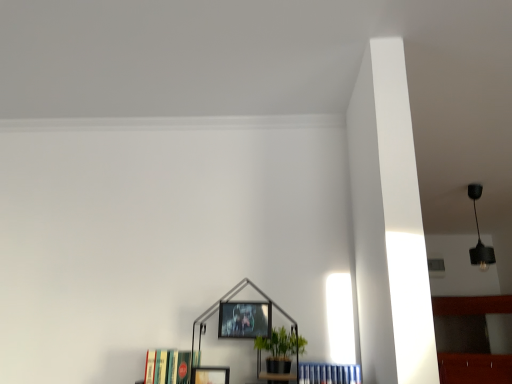
What do you see at coordinates (329, 373) in the screenshot? I see `blue hardcover books at lower center, marked as the second book in a left-to-right arrangement` at bounding box center [329, 373].

Locate an element on the screen. The height and width of the screenshot is (384, 512). green matte plant at center is located at coordinates [x=280, y=349].

Find the location of a particular element. hardcover books at lower left, the first book when ordered from left to right is located at coordinates (169, 366).

Identify the location of metallic silver picture frame at center, acting as the 2th picture frame starting from the bottom. Image resolution: width=512 pixels, height=384 pixels. (245, 320).

From a real-world perspective, is matte black picture frame at lower center, the 1th picture frame ordered from the bottom, physically above hardcover books at lower left, which is the 2th book from right to left?

No, from a real-world perspective, matte black picture frame at lower center, the 1th picture frame ordered from the bottom, is not over hardcover books at lower left, which is the 2th book from right to left

Is hardcover books at lower left, the first book when ordered from left to right, inside matte black picture frame at lower center, which is the first picture frame in left-to-right order?

No, hardcover books at lower left, the first book when ordered from left to right, is located outside of matte black picture frame at lower center, which is the first picture frame in left-to-right order.

Considering the positions of objects matte black picture frame at lower center, placed as the 2th picture frame when sorted from right to left, and hardcover books at lower left, the first book when ordered from left to right, in the image provided, who is more to the left, matte black picture frame at lower center, placed as the 2th picture frame when sorted from right to left, or hardcover books at lower left, the first book when ordered from left to right,?

Positioned to the left is hardcover books at lower left, the first book when ordered from left to right.

Where is `picture frame that is the 1st one when counting backward from the hardcover books at lower left, the first book when ordered from left to right`? The height and width of the screenshot is (384, 512). picture frame that is the 1st one when counting backward from the hardcover books at lower left, the first book when ordered from left to right is located at coordinates (210, 375).

Does blue hardcover books at lower center, which ranks as the first book in right-to-left order, lie in front of matte black picture frame at lower center, the second picture frame viewed from the top?

That is True.

Is blue hardcover books at lower center, marked as the second book in a left-to-right arrangement, not within matte black picture frame at lower center, placed as the 2th picture frame when sorted from right to left?

Indeed, blue hardcover books at lower center, marked as the second book in a left-to-right arrangement, is completely outside matte black picture frame at lower center, placed as the 2th picture frame when sorted from right to left.

Considering the sizes of blue hardcover books at lower center, marked as the second book in a left-to-right arrangement, and matte black picture frame at lower center, which is the first picture frame in left-to-right order, in the image, is blue hardcover books at lower center, marked as the second book in a left-to-right arrangement, taller or shorter than matte black picture frame at lower center, which is the first picture frame in left-to-right order,?

In the image, blue hardcover books at lower center, marked as the second book in a left-to-right arrangement, appears to be taller than matte black picture frame at lower center, which is the first picture frame in left-to-right order.

Looking at this image, is blue hardcover books at lower center, which ranks as the first book in right-to-left order, positioned far away from matte black picture frame at lower center, the 1th picture frame ordered from the bottom?

They are positioned close to each other.

Considering the sizes of objects black matte pendant light at upper right and matte black picture frame at lower center, placed as the 2th picture frame when sorted from right to left, in the image provided, who is wider, black matte pendant light at upper right or matte black picture frame at lower center, placed as the 2th picture frame when sorted from right to left,?

With larger width is black matte pendant light at upper right.

Is black matte pendant light at upper right positioned far away from matte black picture frame at lower center, which is the first picture frame in left-to-right order?

Yes, black matte pendant light at upper right and matte black picture frame at lower center, which is the first picture frame in left-to-right order, are located far from each other.

Who is smaller, black matte pendant light at upper right or matte black picture frame at lower center, the 1th picture frame ordered from the bottom?

matte black picture frame at lower center, the 1th picture frame ordered from the bottom, is smaller.

From a real-world perspective, is black matte pendant light at upper right under matte black picture frame at lower center, placed as the 2th picture frame when sorted from right to left?

No, from a real-world perspective, black matte pendant light at upper right is not below matte black picture frame at lower center, placed as the 2th picture frame when sorted from right to left.

Considering the positions of objects metallic silver picture frame at center, acting as the 2th picture frame starting from the bottom, and blue hardcover books at lower center, marked as the second book in a left-to-right arrangement, in the image provided, who is in front, metallic silver picture frame at center, acting as the 2th picture frame starting from the bottom, or blue hardcover books at lower center, marked as the second book in a left-to-right arrangement,?

blue hardcover books at lower center, marked as the second book in a left-to-right arrangement, is closer to the camera.

From a real-world perspective, which book is the 2nd one underneath the metallic silver picture frame at center, positioned as the first picture frame in right-to-left order? Please provide its 2D coordinates.

[(329, 373)]

Does metallic silver picture frame at center, positioned as the 1th picture frame in top-to-bottom order, have a lesser height compared to blue hardcover books at lower center, which ranks as the first book in right-to-left order?

Correct, metallic silver picture frame at center, positioned as the 1th picture frame in top-to-bottom order, is not as tall as blue hardcover books at lower center, which ranks as the first book in right-to-left order.

Does point (219, 323) lie behind point (336, 368)?

Yes.

Looking at this image, looking at their sizes, would you say black matte pendant light at upper right is wider or thinner than green matte plant at center?

In the image, black matte pendant light at upper right appears to be more narrow than green matte plant at center.

Is black matte pendant light at upper right looking in the opposite direction of green matte plant at center?

No, green matte plant at center is not at the back of black matte pendant light at upper right.

Considering the positions of objects black matte pendant light at upper right and green matte plant at center in the image provided, who is behind, black matte pendant light at upper right or green matte plant at center?

black matte pendant light at upper right.

From the image's perspective, is matte black picture frame at lower center, which is the first picture frame in left-to-right order, above or below blue hardcover books at lower center, which ranks as the first book in right-to-left order?

From the image's perspective, matte black picture frame at lower center, which is the first picture frame in left-to-right order, appears below blue hardcover books at lower center, which ranks as the first book in right-to-left order.

Is matte black picture frame at lower center, placed as the 2th picture frame when sorted from right to left, positioned beyond the bounds of blue hardcover books at lower center, marked as the second book in a left-to-right arrangement?

That's correct, matte black picture frame at lower center, placed as the 2th picture frame when sorted from right to left, is outside of blue hardcover books at lower center, marked as the second book in a left-to-right arrangement.

Based on their sizes in the image, would you say matte black picture frame at lower center, which is the first picture frame in left-to-right order, is bigger or smaller than blue hardcover books at lower center, marked as the second book in a left-to-right arrangement?

In the image, matte black picture frame at lower center, which is the first picture frame in left-to-right order, appears to be smaller than blue hardcover books at lower center, marked as the second book in a left-to-right arrangement.

Does matte black picture frame at lower center, placed as the 2th picture frame when sorted from right to left, have a lesser height compared to blue hardcover books at lower center, which ranks as the first book in right-to-left order?

Yes, matte black picture frame at lower center, placed as the 2th picture frame when sorted from right to left, is shorter than blue hardcover books at lower center, which ranks as the first book in right-to-left order.

Are hardcover books at lower left, which is the 2th book from right to left, and green matte plant at center far apart?

Actually, hardcover books at lower left, which is the 2th book from right to left, and green matte plant at center are a little close together.

Is hardcover books at lower left, the first book when ordered from left to right, bigger than green matte plant at center?

Actually, hardcover books at lower left, the first book when ordered from left to right, might be smaller than green matte plant at center.

Can you confirm if hardcover books at lower left, the first book when ordered from left to right, is wider than green matte plant at center?

No.

From a real-world perspective, is hardcover books at lower left, which is the 2th book from right to left, on green matte plant at center?

Actually, hardcover books at lower left, which is the 2th book from right to left, is physically below green matte plant at center in the real world.

Locate an element on the screen. This screenshot has width=512, height=384. picture frame that is the 1st object to the right of the hardcover books at lower left, which is the 2th book from right to left, starting at the anchor is located at coordinates (210, 375).

There is a matte black picture frame at lower center, the second picture frame viewed from the top. Find the location of `the 1st book above it (from the image's perspective)`. the 1st book above it (from the image's perspective) is located at coordinates (329, 373).

From the image, which object appears to be farther from blue hardcover books at lower center, which ranks as the first book in right-to-left order, green matte plant at center or black matte pendant light at upper right?

black matte pendant light at upper right lies further to blue hardcover books at lower center, which ranks as the first book in right-to-left order, than the other object.

Which object lies further to the anchor point matte black picture frame at lower center, the second picture frame viewed from the top, hardcover books at lower left, which is the 2th book from right to left, or green matte plant at center?

green matte plant at center is further to matte black picture frame at lower center, the second picture frame viewed from the top.

In the scene shown: Looking at the image, which one is located closer to black matte pendant light at upper right, blue hardcover books at lower center, which ranks as the first book in right-to-left order, or matte black picture frame at lower center, placed as the 2th picture frame when sorted from right to left?

Among the two, blue hardcover books at lower center, which ranks as the first book in right-to-left order, is located nearer to black matte pendant light at upper right.

Estimate the real-world distances between objects in this image. Which object is further from hardcover books at lower left, the first book when ordered from left to right, metallic silver picture frame at center, positioned as the 1th picture frame in top-to-bottom order, or matte black picture frame at lower center, placed as the 2th picture frame when sorted from right to left?

metallic silver picture frame at center, positioned as the 1th picture frame in top-to-bottom order, lies further to hardcover books at lower left, the first book when ordered from left to right, than the other object.

When comparing their distances from black matte pendant light at upper right, does matte black picture frame at lower center, the second picture frame viewed from the top, or green matte plant at center seem further?

The object further to black matte pendant light at upper right is matte black picture frame at lower center, the second picture frame viewed from the top.

Estimate the real-world distances between objects in this image. Which object is closer to metallic silver picture frame at center, positioned as the first picture frame in right-to-left order, hardcover books at lower left, the first book when ordered from left to right, or matte black picture frame at lower center, placed as the 2th picture frame when sorted from right to left?

matte black picture frame at lower center, placed as the 2th picture frame when sorted from right to left, is positioned closer to the anchor metallic silver picture frame at center, positioned as the first picture frame in right-to-left order.

Considering their positions, is metallic silver picture frame at center, positioned as the 1th picture frame in top-to-bottom order, positioned closer to blue hardcover books at lower center, marked as the second book in a left-to-right arrangement, than matte black picture frame at lower center, which is the first picture frame in left-to-right order?

Among the two, metallic silver picture frame at center, positioned as the 1th picture frame in top-to-bottom order, is located nearer to blue hardcover books at lower center, marked as the second book in a left-to-right arrangement.

Based on their spatial positions, is matte black picture frame at lower center, which is the first picture frame in left-to-right order, or black matte pendant light at upper right further from blue hardcover books at lower center, which ranks as the first book in right-to-left order?

black matte pendant light at upper right.

You are a GUI agent. You are given a task and a screenshot of the screen. Output one action in this format:
    pyautogui.click(x=<x>, y=<y>)
    Task: Click on the book between hardcover books at lower left, the first book when ordered from left to right, and black matte pendant light at upper right from left to right
    The image size is (512, 384).
    Given the screenshot: What is the action you would take?
    pyautogui.click(x=329, y=373)

Identify the location of houseplant between matte black picture frame at lower center, placed as the 2th picture frame when sorted from right to left, and black matte pendant light at upper right from left to right. (280, 349).

I want to click on picture frame between matte black picture frame at lower center, which is the first picture frame in left-to-right order, and black matte pendant light at upper right from left to right, so pyautogui.click(x=245, y=320).

The image size is (512, 384). Find the location of `picture frame between matte black picture frame at lower center, the 1th picture frame ordered from the bottom, and green matte plant at center, in the horizontal direction`. picture frame between matte black picture frame at lower center, the 1th picture frame ordered from the bottom, and green matte plant at center, in the horizontal direction is located at coordinates (245, 320).